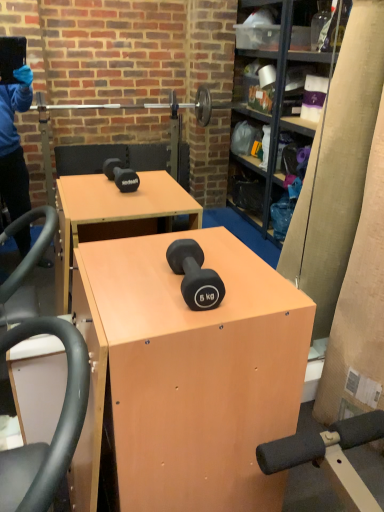
Find the location of a particular element. matte black dumbbell at center is located at coordinates (195, 275).

What do you see at coordinates (195, 275) in the screenshot? I see `matte black dumbbell at center` at bounding box center [195, 275].

The height and width of the screenshot is (512, 384). In order to click on light brown wood desk at center in this screenshot , I will do `click(186, 375)`.

Describe the element at coordinates (186, 375) in the screenshot. This screenshot has height=512, width=384. I see `light brown wood desk at center` at that location.

In order to click on matte black dumbbell at center in this screenshot , I will do `click(195, 275)`.

Is matte black dumbbell at center to the left or to the right of light brown wood desk at center in the image?

matte black dumbbell at center is to the right of light brown wood desk at center.

Consider the image. Does matte black dumbbell at center lie in front of light brown wood desk at center?

No, the depth of matte black dumbbell at center is greater than that of light brown wood desk at center.

Is point (198, 256) closer to camera compared to point (127, 317)?

No, (198, 256) is behind (127, 317).

From the image's perspective, would you say matte black dumbbell at center is positioned over light brown wood desk at center?

Yes, from the image's perspective, matte black dumbbell at center is over light brown wood desk at center.

From a real-world perspective, which is physically below, matte black dumbbell at center or light brown wood desk at center?

light brown wood desk at center.

Considering the relative sizes of matte black dumbbell at center and light brown wood desk at center in the image provided, is matte black dumbbell at center thinner than light brown wood desk at center?

Correct, the width of matte black dumbbell at center is less than that of light brown wood desk at center.

Between matte black dumbbell at center and light brown wood desk at center, which one has less height?

Standing shorter between the two is matte black dumbbell at center.

Does matte black dumbbell at center have a smaller size compared to light brown wood desk at center?

Correct, matte black dumbbell at center occupies less space than light brown wood desk at center.

Is matte black dumbbell at center spatially inside light brown wood desk at center, or outside of it?

The correct answer is: outside.

Is matte black dumbbell at center beside light brown wood desk at center?

They are not placed beside each other.

Is light brown wood desk at center at the back of matte black dumbbell at center?

No, matte black dumbbell at center is not facing the opposite direction of light brown wood desk at center.

How many degrees apart are the facing directions of matte black dumbbell at center and light brown wood desk at center?

The angle between the facing direction of matte black dumbbell at center and the facing direction of light brown wood desk at center is 1.64 degrees.

There is a light brown wood desk at center. Where is `dumbbell above it (from a real-world perspective)`? Image resolution: width=384 pixels, height=512 pixels. dumbbell above it (from a real-world perspective) is located at coordinates (195, 275).

Is light brown wood desk at center at the left side of matte black dumbbell at center?

Correct, you'll find light brown wood desk at center to the left of matte black dumbbell at center.

Considering the relative positions of light brown wood desk at center and matte black dumbbell at center in the image provided, is light brown wood desk at center behind matte black dumbbell at center?

No, the depth of light brown wood desk at center is less than that of matte black dumbbell at center.

Does point (123, 465) appear closer or farther from the camera than point (186, 245)?

Clearly, point (123, 465) is closer to the camera than point (186, 245).

From the image's perspective, between light brown wood desk at center and matte black dumbbell at center, who is located below?

light brown wood desk at center.

From a real-world perspective, who is located lower, light brown wood desk at center or matte black dumbbell at center?

From a 3D spatial view, light brown wood desk at center is below.

Which object is wider, light brown wood desk at center or matte black dumbbell at center?

light brown wood desk at center.

Who is shorter, light brown wood desk at center or matte black dumbbell at center?

matte black dumbbell at center.

Considering the relative sizes of light brown wood desk at center and matte black dumbbell at center in the image provided, is light brown wood desk at center bigger than matte black dumbbell at center?

Yes, light brown wood desk at center is bigger than matte black dumbbell at center.

Is matte black dumbbell at center surrounded by light brown wood desk at center?

No, matte black dumbbell at center is located outside of light brown wood desk at center.

Is light brown wood desk at center not close to matte black dumbbell at center?

That's not correct — light brown wood desk at center is a little close to matte black dumbbell at center.

Does light brown wood desk at center turn towards matte black dumbbell at center?

No, light brown wood desk at center is not turned towards matte black dumbbell at center.

Measure the distance between light brown wood desk at center and matte black dumbbell at center.

A distance of 9.46 inches exists between light brown wood desk at center and matte black dumbbell at center.

I want to click on desk lying below the matte black dumbbell at center (from the image's perspective), so click(186, 375).

This screenshot has width=384, height=512. Find the location of `dumbbell above the light brown wood desk at center (from a real-world perspective)`. dumbbell above the light brown wood desk at center (from a real-world perspective) is located at coordinates (195, 275).

Where is `dumbbell on the right of light brown wood desk at center`? This screenshot has height=512, width=384. dumbbell on the right of light brown wood desk at center is located at coordinates (195, 275).